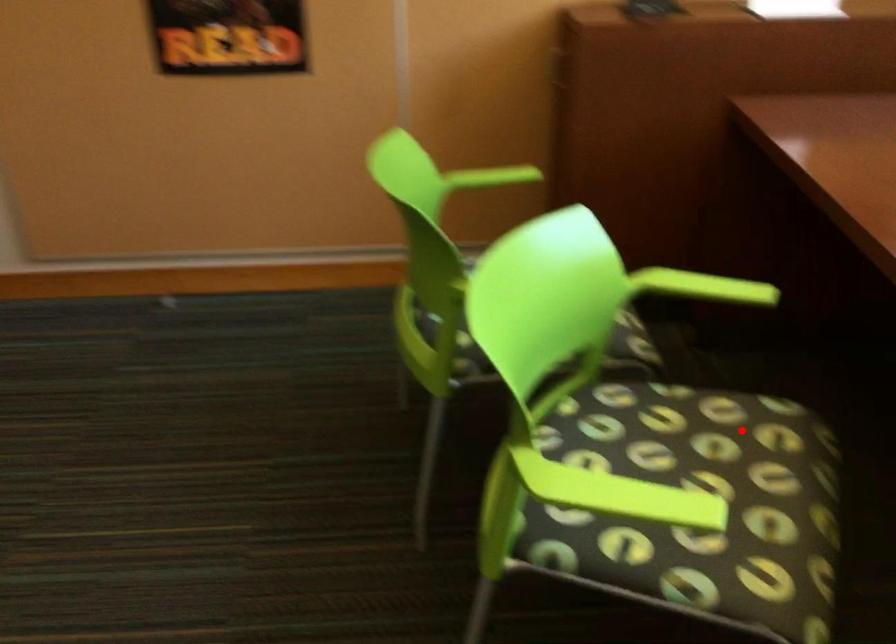
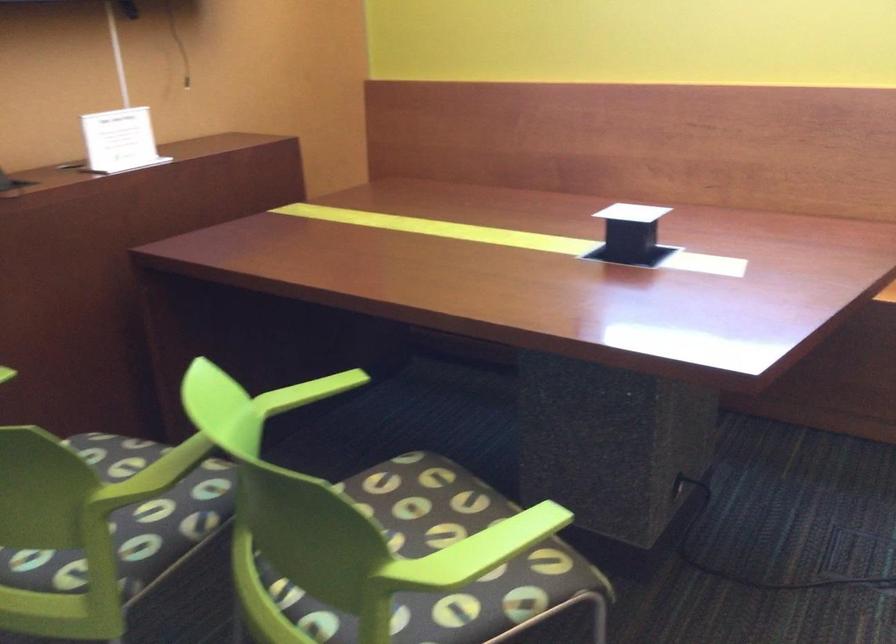
Question: I am providing you with two images of the same scene from different viewpoints. In image1, a red point is highlighted. Considering the same 3D point in image2, which of the following is correct?

Choices:
 (A) It is closer
 (B) It is farther

Answer: (B)